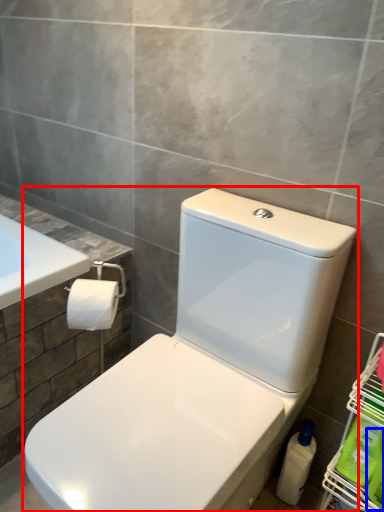
Question: Which of the following is the closest to the observer, toilet (highlighted by a red box) or cleaning product (highlighted by a blue box)?

Choices:
 (A) toilet
 (B) cleaning product

Answer: (A)